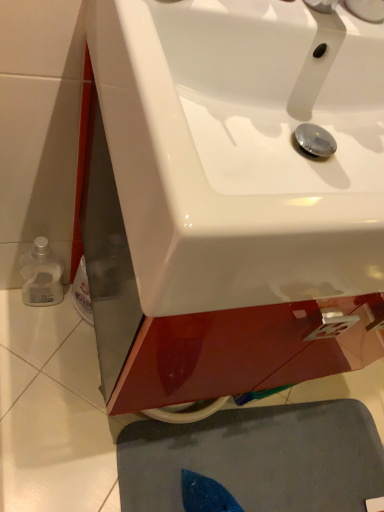
Question: Visually, is white glossy sink at center positioned to the left or to the right of gray matte bath mat at lower center?

Choices:
 (A) left
 (B) right

Answer: (A)

Question: From a real-world perspective, is white glossy sink at center above or below gray matte bath mat at lower center?

Choices:
 (A) above
 (B) below

Answer: (A)

Question: Looking at the image, does white glossy sink at center seem bigger or smaller compared to gray matte bath mat at lower center?

Choices:
 (A) small
 (B) big

Answer: (B)

Question: Which is correct: gray matte bath mat at lower center is inside white glossy sink at center, or outside of it?

Choices:
 (A) outside
 (B) inside

Answer: (A)

Question: In terms of height, does gray matte bath mat at lower center look taller or shorter compared to white glossy sink at center?

Choices:
 (A) short
 (B) tall

Answer: (A)

Question: From the image's perspective, relative to white glossy sink at center, is gray matte bath mat at lower center above or below?

Choices:
 (A) below
 (B) above

Answer: (A)

Question: Based on their sizes in the image, would you say gray matte bath mat at lower center is bigger or smaller than white glossy sink at center?

Choices:
 (A) big
 (B) small

Answer: (B)